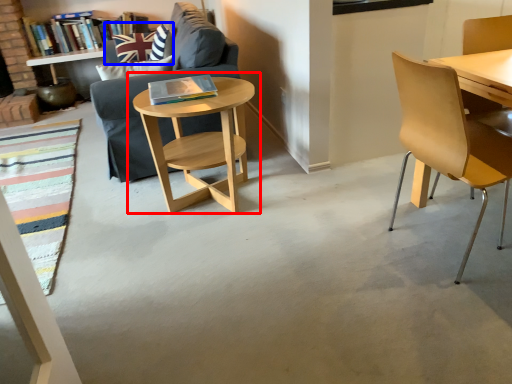
Question: Which point is closer to the camera, table (highlighted by a red box) or pillow (highlighted by a blue box)?

Choices:
 (A) table
 (B) pillow

Answer: (A)